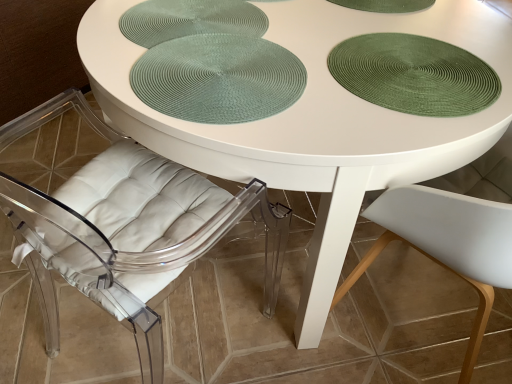
Image resolution: width=512 pixels, height=384 pixels. What are the coordinates of `free space above green woven placemat at upper center, which ranks as the 2th glass plate in right-to-left order (from a real-world perspective)` in the screenshot? It's located at (195, 20).